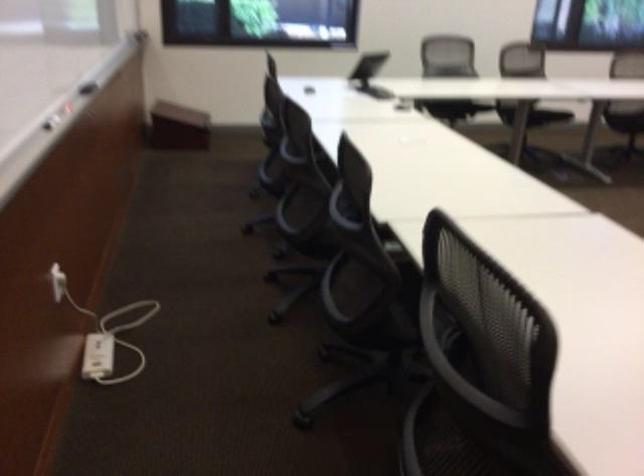
Which object does [104,332] point to?

It refers to a white power adapter.